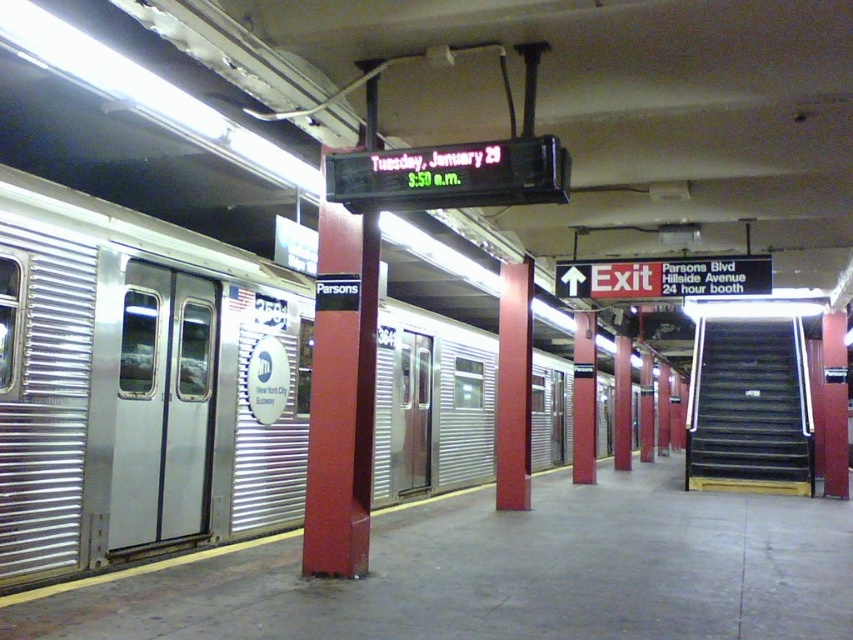
Question: Is black metal stairs at right bigger than metallic red pillar at center?

Choices:
 (A) yes
 (B) no

Answer: (A)

Question: Which point is farther from the camera taking this photo?

Choices:
 (A) (515, 294)
 (B) (798, 333)

Answer: (B)

Question: Which object is closer to the camera taking this photo?

Choices:
 (A) metallic red pillar at center
 (B) black metal stairs at right

Answer: (A)

Question: Is silver metallic train at left positioned before black metal stairs at right?

Choices:
 (A) no
 (B) yes

Answer: (B)

Question: Which of these objects is positioned farthest from the black metal stairs at right?

Choices:
 (A) metallic red pillar at center
 (B) silver metallic train at left

Answer: (A)

Question: Considering the relative positions of black metal stairs at right and metallic red pillar at center in the image provided, where is black metal stairs at right located with respect to metallic red pillar at center?

Choices:
 (A) right
 (B) left

Answer: (A)